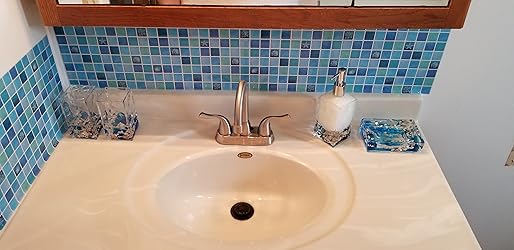
The height and width of the screenshot is (250, 514). I want to click on blue tile wall, so click(x=223, y=56), click(x=11, y=109).